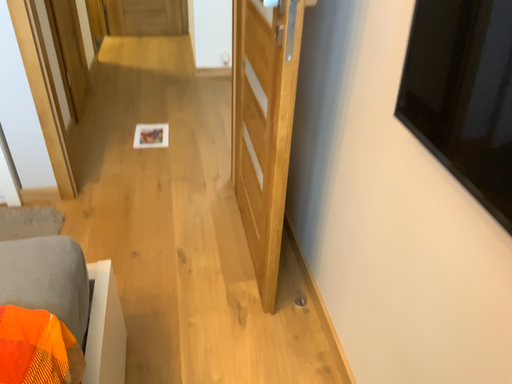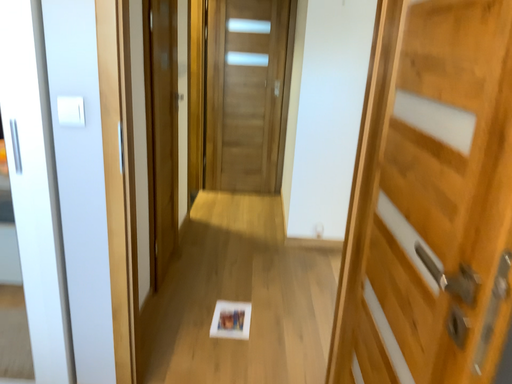
Question: How did the camera likely rotate when shooting the video?

Choices:
 (A) rotated right
 (B) rotated left

Answer: (B)